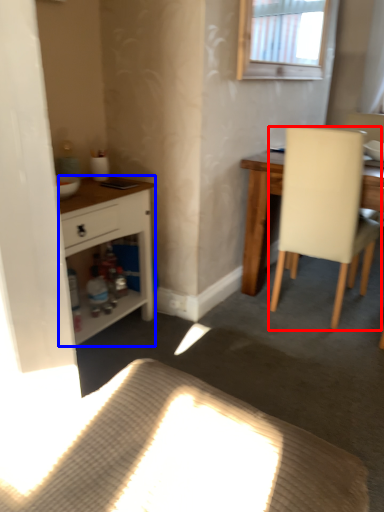
Question: Which object appears closest to the camera in this image, chair (highlighted by a red box) or cabinetry (highlighted by a blue box)?

Choices:
 (A) chair
 (B) cabinetry

Answer: (B)